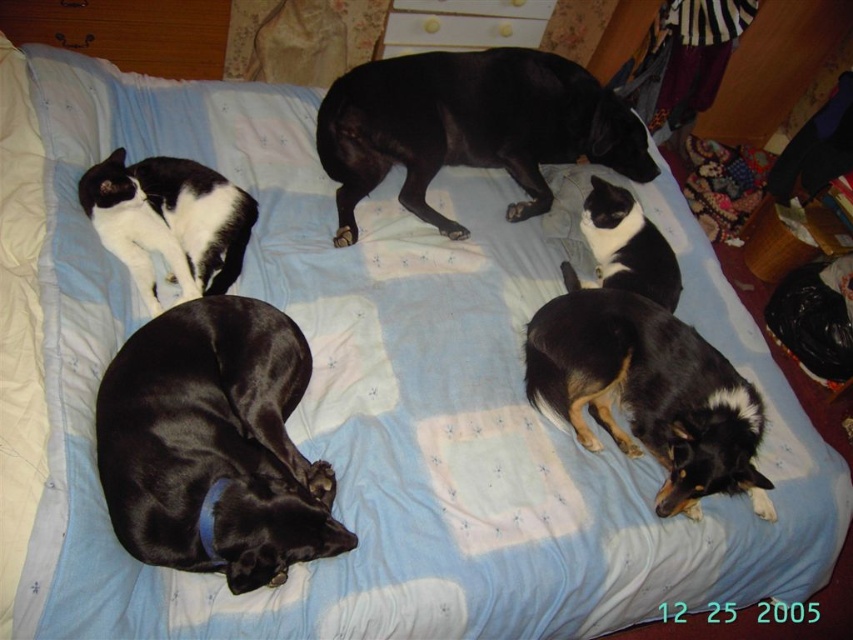
The height and width of the screenshot is (640, 853). Find the location of `black and tan fur dog at center`. black and tan fur dog at center is located at coordinates (647, 392).

Does black and tan fur dog at center have a greater width compared to black and white fur cat at center?

Yes, black and tan fur dog at center is wider than black and white fur cat at center.

Which is in front, point (668, 385) or point (660, 276)?

Point (668, 385) is more forward.

You are a GUI agent. You are given a task and a screenshot of the screen. Output one action in this format:
    pyautogui.click(x=<x>, y=<y>)
    Task: Click on the black and tan fur dog at center
    The image size is (853, 640).
    Given the screenshot: What is the action you would take?
    pyautogui.click(x=647, y=392)

Between shiny black dog at lower left and black smooth dog at upper center, which one has more height?

With more height is black smooth dog at upper center.

What do you see at coordinates (213, 444) in the screenshot? I see `shiny black dog at lower left` at bounding box center [213, 444].

Is point (213, 310) less distant than point (328, 157)?

Yes, it is.

This screenshot has width=853, height=640. Find the location of `shiny black dog at lower left`. shiny black dog at lower left is located at coordinates (213, 444).

Is point (601, 128) more distant than point (128, 198)?

Yes, it is behind point (128, 198).

Find the location of a particular element. The height and width of the screenshot is (640, 853). black smooth dog at upper center is located at coordinates (469, 125).

Identify the location of black smooth dog at upper center. (469, 125).